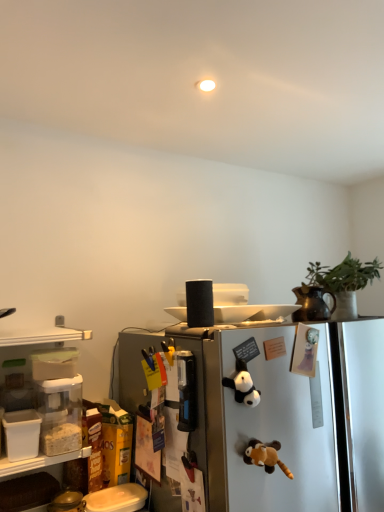
Question: Is green matte plant at upper right surrounded by satin silver refrigerator at center?

Choices:
 (A) no
 (B) yes

Answer: (A)

Question: Does satin silver refrigerator at center appear on the right side of green matte plant at upper right?

Choices:
 (A) no
 (B) yes

Answer: (A)

Question: Is satin silver refrigerator at center at the left side of green matte plant at upper right?

Choices:
 (A) no
 (B) yes

Answer: (B)

Question: From the image's perspective, would you say satin silver refrigerator at center is positioned over green matte plant at upper right?

Choices:
 (A) yes
 (B) no

Answer: (B)

Question: Does satin silver refrigerator at center have a lesser width compared to green matte plant at upper right?

Choices:
 (A) no
 (B) yes

Answer: (A)

Question: Can you confirm if satin silver refrigerator at center is smaller than green matte plant at upper right?

Choices:
 (A) yes
 (B) no

Answer: (B)

Question: Is brown plush toy at center, marked as the second toy in a top-to-bottom arrangement, completely or partially outside of black plush panda at center, positioned as the first toy in top-to-bottom order?

Choices:
 (A) no
 (B) yes

Answer: (B)

Question: Does brown plush toy at center, marked as the second toy in a top-to-bottom arrangement, have a smaller size compared to black plush panda at center, the 2th toy when ordered from bottom to top?

Choices:
 (A) yes
 (B) no

Answer: (B)

Question: Considering the relative sizes of brown plush toy at center, marked as the second toy in a top-to-bottom arrangement, and black plush panda at center, the 2th toy when ordered from bottom to top, in the image provided, is brown plush toy at center, marked as the second toy in a top-to-bottom arrangement, shorter than black plush panda at center, the 2th toy when ordered from bottom to top,?

Choices:
 (A) no
 (B) yes

Answer: (B)

Question: Considering the relative positions of brown plush toy at center, the first toy in the bottom-to-top sequence, and black plush panda at center, the 2th toy when ordered from bottom to top, in the image provided, is brown plush toy at center, the first toy in the bottom-to-top sequence, to the left of black plush panda at center, the 2th toy when ordered from bottom to top, from the viewer's perspective?

Choices:
 (A) yes
 (B) no

Answer: (B)

Question: Is brown plush toy at center, the first toy in the bottom-to-top sequence, positioned behind black plush panda at center, the 2th toy when ordered from bottom to top?

Choices:
 (A) yes
 (B) no

Answer: (B)

Question: From a real-world perspective, does brown plush toy at center, marked as the second toy in a top-to-bottom arrangement, stand above black plush panda at center, the 2th toy when ordered from bottom to top?

Choices:
 (A) no
 (B) yes

Answer: (A)

Question: Is green matte plant at upper right at the right side of black plush panda at center, positioned as the first toy in top-to-bottom order?

Choices:
 (A) yes
 (B) no

Answer: (A)